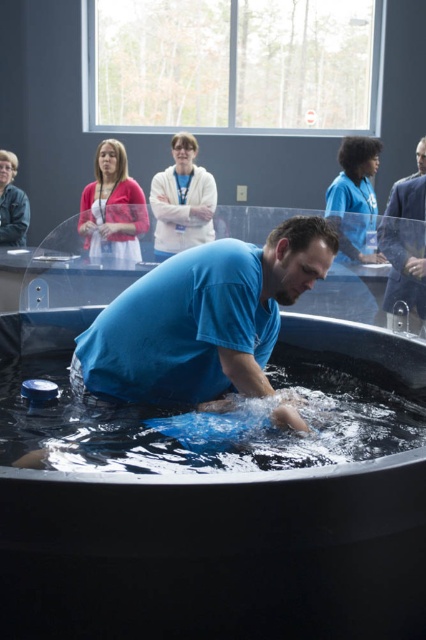
Question: Can you confirm if black plastic tub at center is positioned to the left of blue matte shirt at center?

Choices:
 (A) no
 (B) yes

Answer: (A)

Question: Among these points, which one is farthest from the camera?

Choices:
 (A) (399, 205)
 (B) (152, 328)
 (C) (77, 227)
 (D) (206, 616)

Answer: (C)

Question: Which point appears farthest from the camera in this image?

Choices:
 (A) (97, 225)
 (B) (250, 312)
 (C) (417, 259)

Answer: (A)

Question: Among these points, which one is nearest to the camera?

Choices:
 (A) (209, 486)
 (B) (91, 211)
 (C) (423, 314)

Answer: (A)

Question: Is matte pink cardigan at upper left thinner than blue smooth shirt at right?

Choices:
 (A) yes
 (B) no

Answer: (B)

Question: Is matte pink cardigan at upper left thinner than blue smooth shirt at right?

Choices:
 (A) no
 (B) yes

Answer: (A)